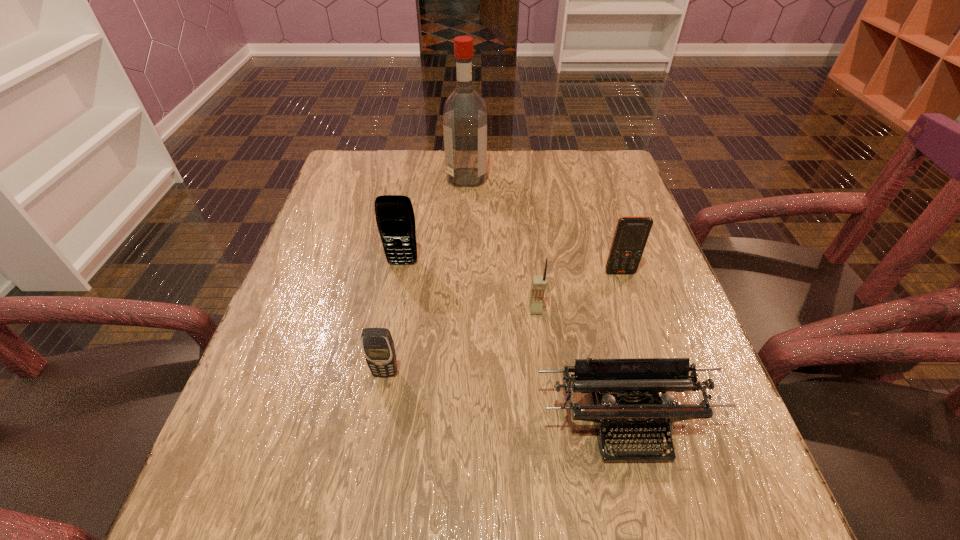
The height and width of the screenshot is (540, 960). In order to click on blank region between the second nearest cellular telephone and the fifth farthest object in this screenshot , I will do 461,341.

Identify the location of free point between the fourth object from right to left and the second nearest cellular telephone. (501, 244).

Locate an element on the screen. This screenshot has width=960, height=540. unoccupied position between the shortest object and the shortest cellular telephone is located at coordinates (506, 399).

Find the location of a particular element. unoccupied position between the tallest object and the nearest object is located at coordinates (547, 301).

Find the location of a particular element. Image resolution: width=960 pixels, height=540 pixels. free space between the second farthest cellular telephone and the fifth nearest object is located at coordinates (512, 268).

I want to click on object that stands as the fifth closest to the farthest cellular telephone, so point(631,234).

This screenshot has height=540, width=960. Identify the location of object that stands as the second closest to the second cellular telephone from right to left. (631, 234).

Identify the location of cellular telephone identified as the third closest to the tallest object. Image resolution: width=960 pixels, height=540 pixels. (538, 285).

Find the location of `the second closest cellular telephone to the fourth farthest object`. the second closest cellular telephone to the fourth farthest object is located at coordinates (395, 219).

The height and width of the screenshot is (540, 960). I want to click on vacant space that satisfies the following two spatial constraints: 1. on the front-facing side of the farthest object; 2. on the front face of the second nearest object, so click(459, 373).